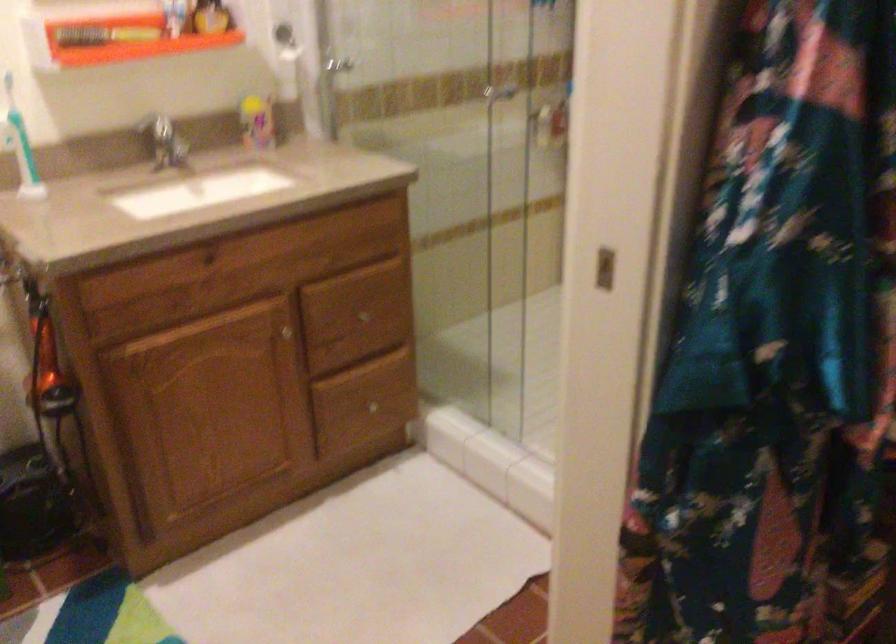
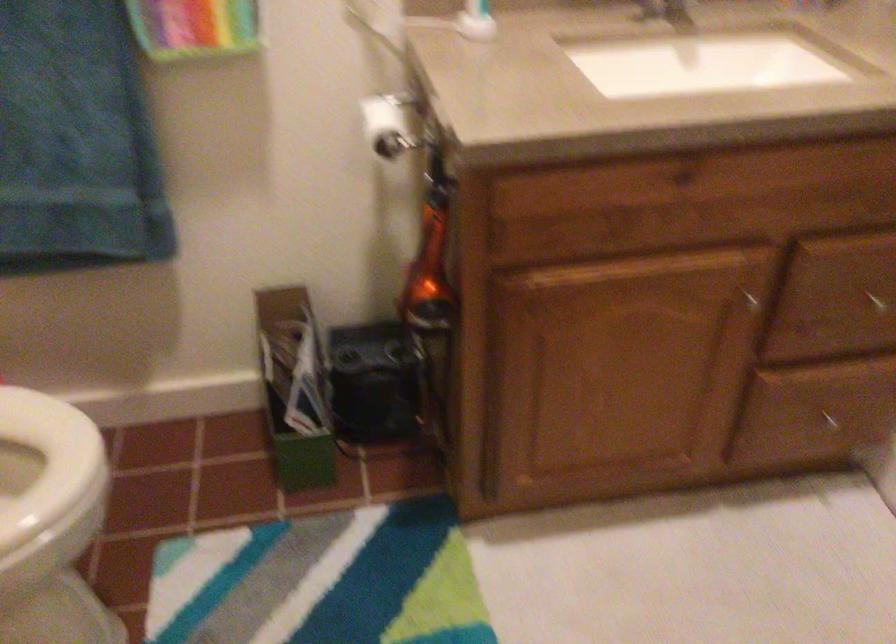
In the second image, find the point that corresponds to (366,319) in the first image.

(875, 301)